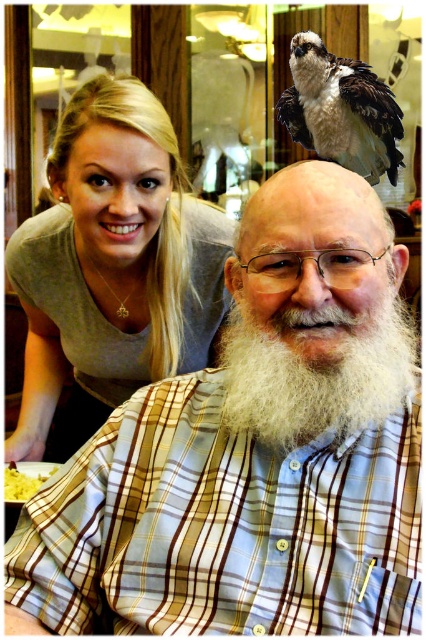
You are standing in the room and want to place a small sticker exactly at the point with coordinates (112,266). According to the image, where should you place it?

The point with coordinates (112,266) is located on the matte gray shirt at upper left.

Looking at this image, you are a delivery person who needs to place a small package between the matte gray shirt at upper left and the brown speckled feathers at upper right. The package is 3 feet long. Can you fit it between them without moving either object?

The distance between the matte gray shirt at upper left and the brown speckled feathers at upper right is 3.70 feet. Since the package is 3 feet long, it can fit between them as the space is slightly larger than the package.

You are standing in the room and see the point at coordinates (112, 266). Which object is this point located on?

The point at coordinates (112, 266) is located on the matte gray shirt at upper left.